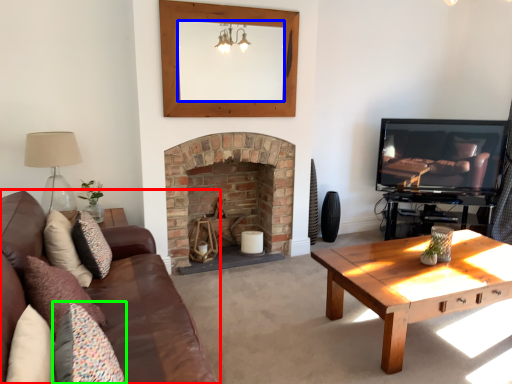
Question: Based on their relative distances, which object is farther from studio couch (highlighted by a red box)? Choose from mirror (highlighted by a blue box) and pillow (highlighted by a green box).

Choices:
 (A) mirror
 (B) pillow

Answer: (A)